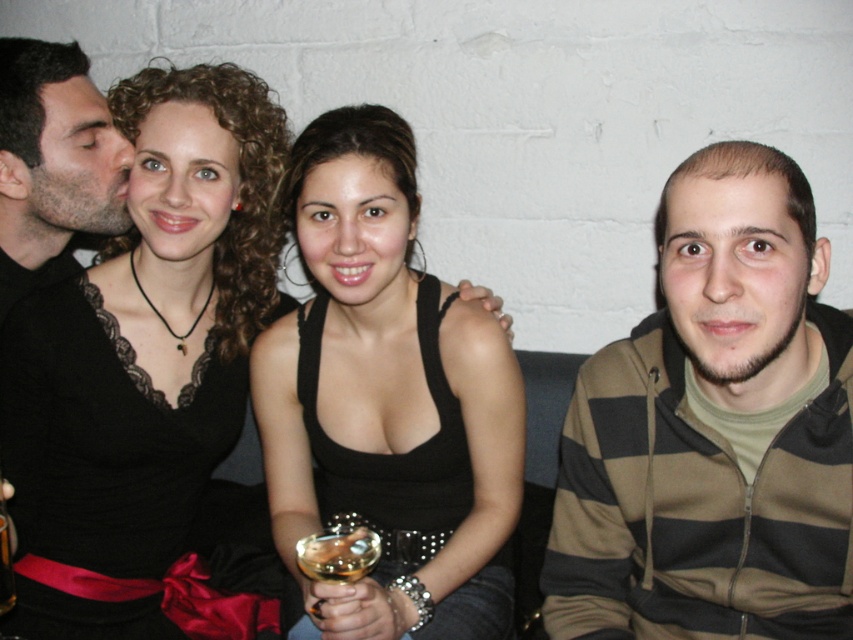
How far apart are translucent glass wine glass at center and translucent glass wine at center?

The distance of translucent glass wine glass at center from translucent glass wine at center is 11.77 inches.

Does translucent glass wine glass at center appear under translucent glass wine at center?

Correct, translucent glass wine glass at center is located below translucent glass wine at center.

This screenshot has width=853, height=640. What do you see at coordinates (338, 554) in the screenshot?
I see `translucent glass wine glass at center` at bounding box center [338, 554].

Image resolution: width=853 pixels, height=640 pixels. Identify the location of translucent glass wine glass at center. (338, 554).

Between striped hoodie at right and translucent glass wine glass at center, which one appears on the right side from the viewer's perspective?

From the viewer's perspective, striped hoodie at right appears more on the right side.

Can you confirm if striped hoodie at right is bigger than translucent glass wine glass at center?

Indeed, striped hoodie at right has a larger size compared to translucent glass wine glass at center.

Who is more distant from viewer, (633, 588) or (317, 600)?

The point (633, 588) is more distant.

At what (x,y) coordinates should I click in order to perform the action: click on striped hoodie at right. Please return your answer as a coordinate pair (x, y). Image resolution: width=853 pixels, height=640 pixels. Looking at the image, I should click on (714, 429).

Is the position of striped hoodie at right more distant than that of black matte shirt at left?

That is False.

Between point (653, 326) and point (21, 228), which one is positioned behind?

The point (21, 228) is more distant.

Does point (618, 586) come closer to viewer compared to point (28, 100)?

Yes, it is in front of point (28, 100).

I want to click on striped hoodie at right, so click(714, 429).